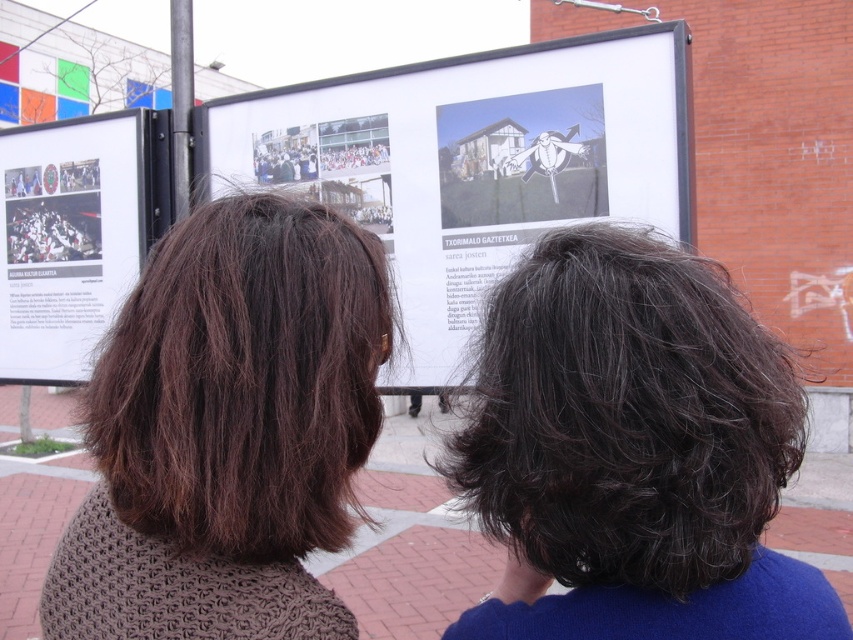
Question: Which of the following is the closest to the observer?

Choices:
 (A) brown wavy hair at center
 (B) matte paper poster at left

Answer: (A)

Question: Which object is the closest to the dark brown curly hair at center?

Choices:
 (A) matte paper poster at left
 (B) brown wavy hair at center
 (C) white glossy poster at center

Answer: (B)

Question: Does white glossy poster at center have a greater width compared to matte paper poster at left?

Choices:
 (A) no
 (B) yes

Answer: (B)

Question: Does dark brown curly hair at center have a greater width compared to white glossy poster at center?

Choices:
 (A) yes
 (B) no

Answer: (B)

Question: Which object is farther from the camera taking this photo?

Choices:
 (A) white glossy poster at center
 (B) matte paper poster at left
 (C) dark brown curly hair at center

Answer: (B)

Question: Is dark brown curly hair at center further to camera compared to white glossy poster at center?

Choices:
 (A) no
 (B) yes

Answer: (A)